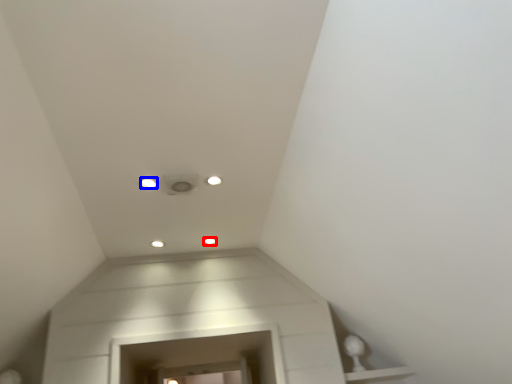
Question: Which of the following is the farthest to the observer, dot (highlighted by a red box) or dot (highlighted by a blue box)?

Choices:
 (A) dot
 (B) dot

Answer: (A)